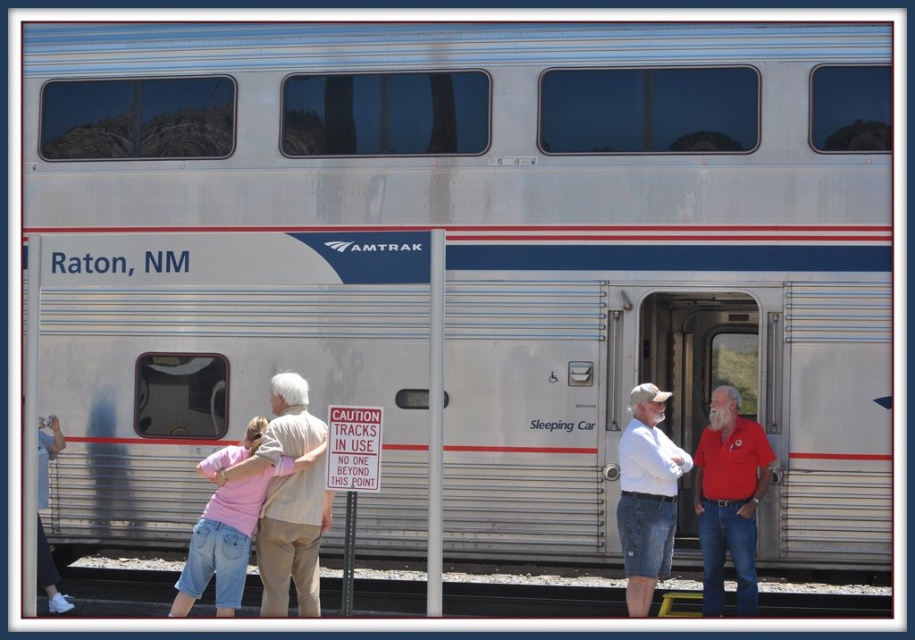
Can you confirm if denim shorts at center is thinner than white shirt at left?

No, denim shorts at center is not thinner than white shirt at left.

Is point (641, 564) farther from camera compared to point (42, 557)?

No, it is in front of (42, 557).

At what (x,y) coordinates should I click in order to perform the action: click on denim shorts at center. Please return your answer as a coordinate pair (x, y). Looking at the image, I should click on (646, 496).

Is point (277, 580) positioned in front of point (720, 390)?

Yes, it is in front of point (720, 390).

Does pink fabric shirt at left have a greater width compared to red cotton shirt at right?

Indeed, pink fabric shirt at left has a greater width compared to red cotton shirt at right.

Consider the image. Who is more forward, (311, 545) or (751, 595)?

Positioned in front is point (311, 545).

The image size is (915, 640). Find the location of `pink fabric shirt at left`. pink fabric shirt at left is located at coordinates pos(292,540).

Which is more to the left, gray gravel at lower center or white shirt at left?

Positioned to the left is white shirt at left.

Identify the location of gray gravel at lower center. Image resolution: width=915 pixels, height=640 pixels. (531, 596).